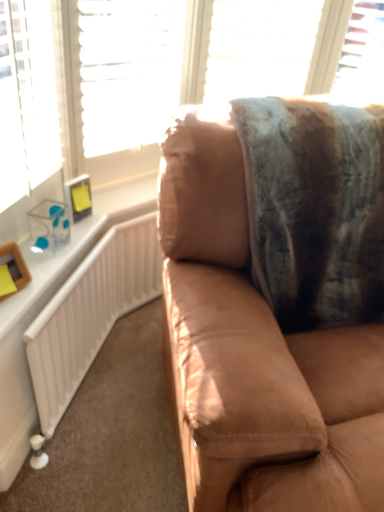
Image resolution: width=384 pixels, height=512 pixels. Describe the element at coordinates (260, 47) in the screenshot. I see `white textured blind at upper center` at that location.

Identify the location of white textured blind at upper center. This screenshot has height=512, width=384. 260,47.

This screenshot has width=384, height=512. What do you see at coordinates (315, 209) in the screenshot?
I see `fuzzy woolen blanket at upper right` at bounding box center [315, 209].

Describe the element at coordinates (276, 302) in the screenshot. The image size is (384, 512). I see `suede brown couch at center` at that location.

The height and width of the screenshot is (512, 384). Describe the element at coordinates (363, 53) in the screenshot. I see `transparent plastic window at upper right` at that location.

At what (x,y) coordinates should I click in order to perform the action: click on transparent plastic window at upper right. Please return your answer as a coordinate pair (x, y). Looking at the image, I should click on (363, 53).

Where is `white glossy radiator at left`? This screenshot has height=512, width=384. white glossy radiator at left is located at coordinates (24, 343).

Is fuzzy woolen blanket at upper right bigger than suede brown couch at center?

No, fuzzy woolen blanket at upper right is not bigger than suede brown couch at center.

Is fuzzy woolen blanket at upper right taller or shorter than suede brown couch at center?

Considering their sizes, fuzzy woolen blanket at upper right has less height than suede brown couch at center.

Does fuzzy woolen blanket at upper right appear on the right side of suede brown couch at center?

No.

Would you consider fuzzy woolen blanket at upper right to be distant from suede brown couch at center?

No, fuzzy woolen blanket at upper right is in close proximity to suede brown couch at center.

Who is taller, white glossy radiator at left or transparent plastic window at upper right?

Standing taller between the two is white glossy radiator at left.

Does white glossy radiator at left lie in front of transparent plastic window at upper right?

That is True.

Would you consider white glossy radiator at left to be distant from transparent plastic window at upper right?

white glossy radiator at left is far away from transparent plastic window at upper right.

Can you confirm if white glossy radiator at left is smaller than transparent plastic window at upper right?

Yes.

Considering the relative positions of white glossy radiator at left and fuzzy woolen blanket at upper right in the image provided, is white glossy radiator at left in front of fuzzy woolen blanket at upper right?

No.

Is white glossy radiator at left situated inside fuzzy woolen blanket at upper right or outside?

white glossy radiator at left exists outside the volume of fuzzy woolen blanket at upper right.

How much distance is there between white glossy radiator at left and fuzzy woolen blanket at upper right?

They are 30.05 inches apart.

Considering the sizes of white glossy radiator at left and fuzzy woolen blanket at upper right in the image, is white glossy radiator at left wider or thinner than fuzzy woolen blanket at upper right?

Clearly, white glossy radiator at left has less width compared to fuzzy woolen blanket at upper right.

Can you confirm if transparent plastic window at upper right is smaller than white glossy radiator at left?

Incorrect, transparent plastic window at upper right is not smaller in size than white glossy radiator at left.

Can you confirm if transparent plastic window at upper right is positioned to the left of white glossy radiator at left?

Incorrect, transparent plastic window at upper right is not on the left side of white glossy radiator at left.

What are the coordinates of `table below the transparent plastic window at upper right (from the image's perspective)` in the screenshot? It's located at (24, 343).

The width and height of the screenshot is (384, 512). I want to click on studio couch on the right of white glossy radiator at left, so click(276, 302).

Is suede brown couch at center completely or partially inside white glossy radiator at left?

That's incorrect, suede brown couch at center is not inside white glossy radiator at left.

Considering the relative positions of white glossy radiator at left and suede brown couch at center in the image provided, is white glossy radiator at left to the right of suede brown couch at center from the viewer's perspective?

No, white glossy radiator at left is not to the right of suede brown couch at center.

Are white glossy radiator at left and suede brown couch at center far apart?

Actually, white glossy radiator at left and suede brown couch at center are a little close together.

Is transparent plastic window at upper right aimed at white textured blind at upper center?

No, transparent plastic window at upper right does not turn towards white textured blind at upper center.

Is transparent plastic window at upper right at the left side of white textured blind at upper center?

No, transparent plastic window at upper right is not to the left of white textured blind at upper center.

Is transparent plastic window at upper right positioned in front of white textured blind at upper center?

No, transparent plastic window at upper right is further to the viewer.

Is transparent plastic window at upper right positioned beyond the bounds of white textured blind at upper center?

Yes, transparent plastic window at upper right is outside of white textured blind at upper center.

Is white textured blind at upper center aimed at white glossy radiator at left?

No, white textured blind at upper center is not facing towards white glossy radiator at left.

Between white textured blind at upper center and white glossy radiator at left, which one has larger size?

Bigger between the two is white textured blind at upper center.

At what (x,y) coordinates should I click in order to perform the action: click on table below the white textured blind at upper center (from the image's perspective). Please return your answer as a coordinate pair (x, y). The image size is (384, 512). Looking at the image, I should click on [x=24, y=343].

From the image's perspective, which is below, white textured blind at upper center or white glossy radiator at left?

white glossy radiator at left appears lower in the image.

This screenshot has height=512, width=384. In the image, there is a fuzzy woolen blanket at upper right. In order to click on studio couch below it (from a real-world perspective) in this screenshot , I will do `click(276, 302)`.

Locate an element on the screen. The image size is (384, 512). table in front of the transparent plastic window at upper right is located at coordinates point(24,343).

Considering their positions, is fuzzy woolen blanket at upper right positioned closer to suede brown couch at center than transparent plastic window at upper right?

Based on the image, fuzzy woolen blanket at upper right appears to be nearer to suede brown couch at center.

Looking at the image, which one is located further to fuzzy woolen blanket at upper right, white glossy radiator at left or suede brown couch at center?

white glossy radiator at left is further to fuzzy woolen blanket at upper right.

Looking at the image, which one is located closer to transparent plastic window at upper right, white glossy radiator at left or white textured blind at upper center?

white textured blind at upper center is positioned closer to the anchor transparent plastic window at upper right.

Estimate the real-world distances between objects in this image. Which object is closer to transparent plastic window at upper right, white textured blind at upper center or suede brown couch at center?

white textured blind at upper center lies closer to transparent plastic window at upper right than the other object.

Based on the photo, considering their positions, is transparent plastic window at upper right positioned closer to fuzzy woolen blanket at upper right than white glossy radiator at left?

white glossy radiator at left is closer to fuzzy woolen blanket at upper right.

Which object lies nearer to the anchor point white textured blind at upper center, fuzzy woolen blanket at upper right or transparent plastic window at upper right?

transparent plastic window at upper right lies closer to white textured blind at upper center than the other object.

Which object lies nearer to the anchor point fuzzy woolen blanket at upper right, suede brown couch at center or white glossy radiator at left?

Among the two, suede brown couch at center is located nearer to fuzzy woolen blanket at upper right.

Looking at the image, which one is located closer to white glossy radiator at left, transparent plastic window at upper right or fuzzy woolen blanket at upper right?

The object closer to white glossy radiator at left is fuzzy woolen blanket at upper right.

Locate an element on the screen. The height and width of the screenshot is (512, 384). blind between transparent plastic window at upper right and white glossy radiator at left in the vertical direction is located at coordinates (260, 47).

This screenshot has height=512, width=384. In order to click on studio couch that lies between transparent plastic window at upper right and white glossy radiator at left from top to bottom in this screenshot , I will do `click(276, 302)`.

You are a GUI agent. You are given a task and a screenshot of the screen. Output one action in this format:
    pyautogui.click(x=<x>, y=<y>)
    Task: Click on the blind between suede brown couch at center and transparent plastic window at upper right along the z-axis
    The image size is (384, 512).
    Given the screenshot: What is the action you would take?
    pyautogui.click(x=260, y=47)

The height and width of the screenshot is (512, 384). Find the location of `blanket between suede brown couch at center and transparent plastic window at upper right along the z-axis`. blanket between suede brown couch at center and transparent plastic window at upper right along the z-axis is located at coordinates (315, 209).